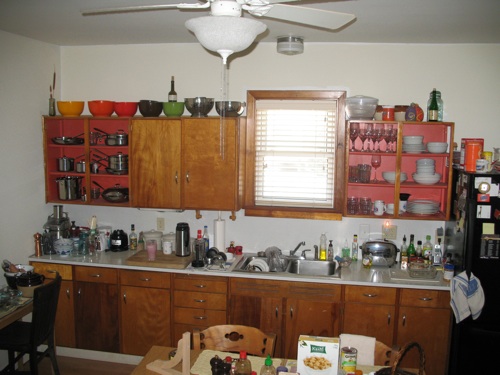
The height and width of the screenshot is (375, 500). In order to click on fan light in this screenshot , I will do `click(231, 44)`, `click(213, 32)`, `click(220, 57)`.